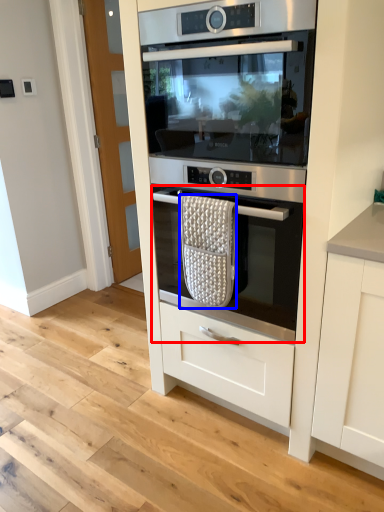
Question: Which object is closer to the camera taking this photo, oven (highlighted by a red box) or material (highlighted by a blue box)?

Choices:
 (A) oven
 (B) material

Answer: (A)